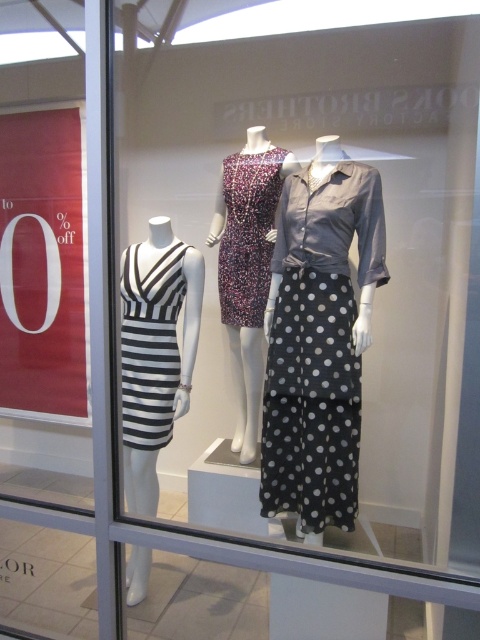
You are a customer looking at the store display window. You see the gray polka dot skirt at center and the black striped dress at left. Which item is placed lower in the display?

The gray polka dot skirt at center is positioned under the black striped dress at left, so it is placed lower in the display.

Looking at this image, you are standing in front of the store display window and want to touch the point at coordinates point (272,396). Can you reach it if your maximum reaching distance is 6.5 feet?

The distance of point (272,396) from camera is 7.05 feet, which is beyond your maximum reaching distance of 6.5 feet. You cannot reach it.